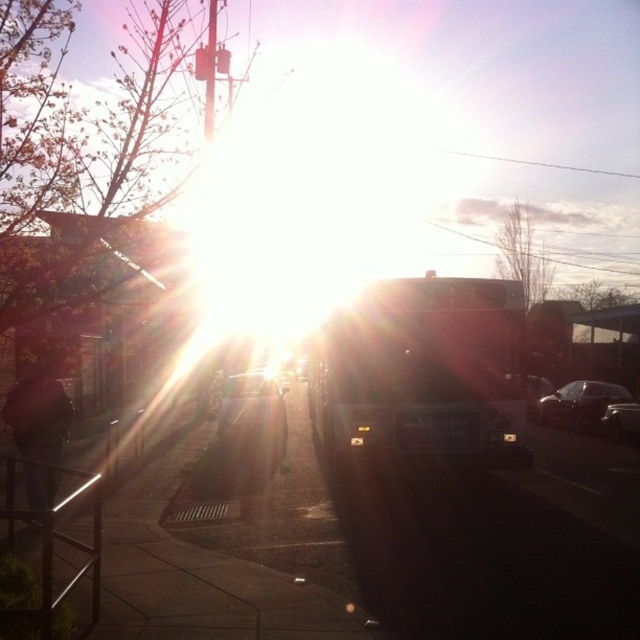
You are standing on the sidewalk and want to cross the street to reach the metallic silver car at center. The crosswalk is 16 meters away from your current position. Can you safely reach the car without needing to walk further than the crosswalk?

The metallic silver car at center is 16.14 meters away from your current position. Since the crosswalk is only 16 meters away, you will need to walk an additional 0.14 meters beyond the crosswalk to reach the metallic silver car at center.

You are a pedestrian standing at the metallic silver bus stop at lower left and want to walk to the shiny silver car at center. Given that the bus stop is smaller than the car, will you have to walk around the bus stop to reach the car?

The metallic silver bus stop at lower left has a smaller size compared to the shiny silver car at center, so you will not need to walk around the bus stop to reach the car since it is smaller in size.